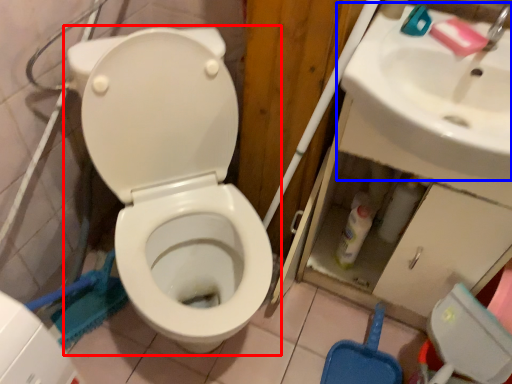
Question: Which object appears farthest to the camera in this image, toilet (highlighted by a red box) or sink (highlighted by a blue box)?

Choices:
 (A) toilet
 (B) sink

Answer: (B)